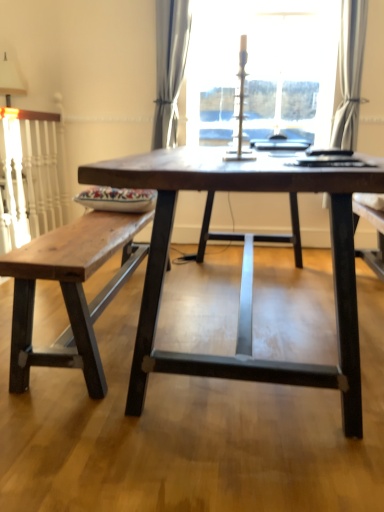
Question: Is white fabric lampshade at upper left placed right next to dark wood table at center?

Choices:
 (A) yes
 (B) no

Answer: (B)

Question: Considering the relative positions of white fabric lampshade at upper left and dark wood table at center in the image provided, is white fabric lampshade at upper left to the left of dark wood table at center from the viewer's perspective?

Choices:
 (A) no
 (B) yes

Answer: (B)

Question: Is the position of white fabric lampshade at upper left more distant than that of dark wood table at center?

Choices:
 (A) no
 (B) yes

Answer: (B)

Question: Is the position of white fabric lampshade at upper left less distant than that of dark wood table at center?

Choices:
 (A) no
 (B) yes

Answer: (A)

Question: From the image's perspective, is white fabric lampshade at upper left below dark wood table at center?

Choices:
 (A) no
 (B) yes

Answer: (A)

Question: Is point (352, 80) closer or farther from the camera than point (238, 315)?

Choices:
 (A) closer
 (B) farther

Answer: (B)

Question: In terms of height, does white sheer curtain at upper right, which is the second curtain from left to right, look taller or shorter compared to dark wood table at center?

Choices:
 (A) short
 (B) tall

Answer: (B)

Question: From the image's perspective, is white sheer curtain at upper right, which appears as the 1th curtain when viewed from the right, located above or below dark wood table at center?

Choices:
 (A) below
 (B) above

Answer: (B)

Question: In terms of width, does white sheer curtain at upper right, which appears as the 1th curtain when viewed from the right, look wider or thinner when compared to dark wood table at center?

Choices:
 (A) thin
 (B) wide

Answer: (A)

Question: In terms of height, does white sheer curtain at upper right, which appears as the 1th curtain when viewed from the right, look taller or shorter compared to rustic wood bench at left?

Choices:
 (A) tall
 (B) short

Answer: (A)

Question: Is white sheer curtain at upper right, which is the second curtain from left to right, wider or thinner than rustic wood bench at left?

Choices:
 (A) thin
 (B) wide

Answer: (A)

Question: In the image, is white sheer curtain at upper right, which is the second curtain from left to right, on the left side or the right side of rustic wood bench at left?

Choices:
 (A) right
 (B) left

Answer: (A)

Question: Considering the positions of point (342, 7) and point (18, 251), is point (342, 7) closer or farther from the camera than point (18, 251)?

Choices:
 (A) farther
 (B) closer

Answer: (A)

Question: Does point (74, 331) appear closer or farther from the camera than point (286, 34)?

Choices:
 (A) closer
 (B) farther

Answer: (A)

Question: From the image's perspective, is rustic wood bench at left positioned above or below transparent glass candlestick at upper center?

Choices:
 (A) above
 (B) below

Answer: (B)